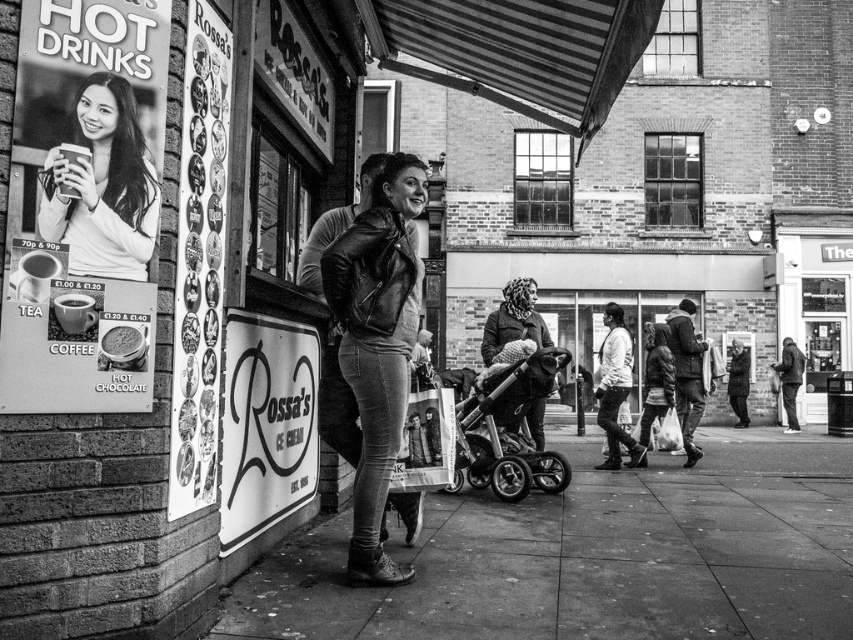
Looking at this image, does smooth skin portrait at upper left appear on the left side of light gray jacket at center?

Yes, smooth skin portrait at upper left is to the left of light gray jacket at center.

Who is more forward, (x=125, y=186) or (x=624, y=429)?

Point (x=125, y=186) is more forward.

You are a GUI agent. You are given a task and a screenshot of the screen. Output one action in this format:
    pyautogui.click(x=<x>, y=<y>)
    Task: Click on the smooth skin portrait at upper left
    This screenshot has height=640, width=853.
    Given the screenshot: What is the action you would take?
    [103, 186]

Does smooth skin portrait at upper left have a lesser width compared to knitted woolen scarf at center?

No, smooth skin portrait at upper left is not thinner than knitted woolen scarf at center.

Is smooth skin portrait at upper left above knitted woolen scarf at center?

Indeed, smooth skin portrait at upper left is positioned over knitted woolen scarf at center.

Is point (70, 221) less distant than point (489, 330)?

Yes.

Locate an element on the screen. smooth skin portrait at upper left is located at coordinates (103, 186).

Can you confirm if smooth concrete pavement at lower center is thinner than smooth skin portrait at upper left?

No.

Between smooth concrete pavement at lower center and smooth skin portrait at upper left, which one appears on the left side from the viewer's perspective?

smooth skin portrait at upper left is more to the left.

This screenshot has height=640, width=853. In order to click on smooth concrete pavement at lower center in this screenshot , I will do `click(595, 556)`.

Identify the location of smooth concrete pavement at lower center. Image resolution: width=853 pixels, height=640 pixels. (595, 556).